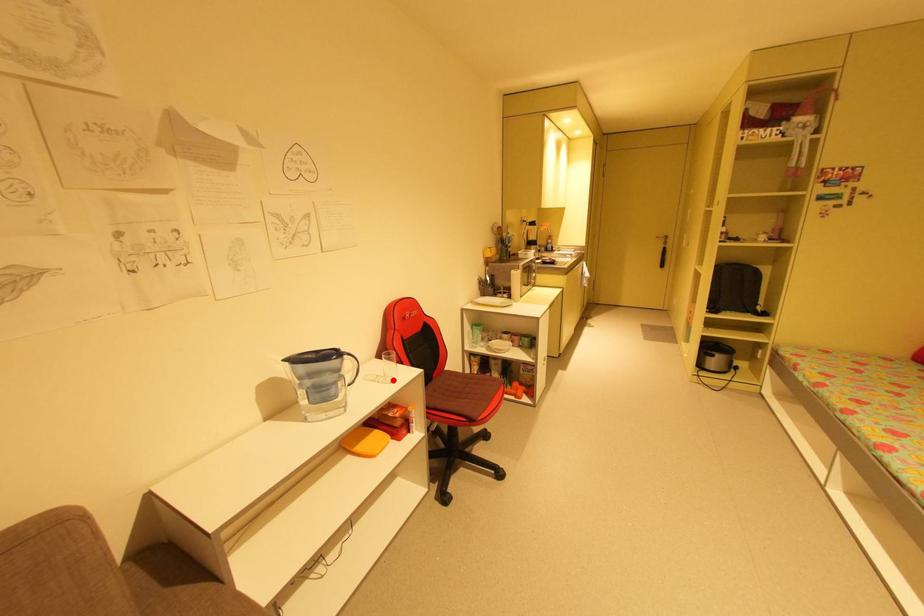
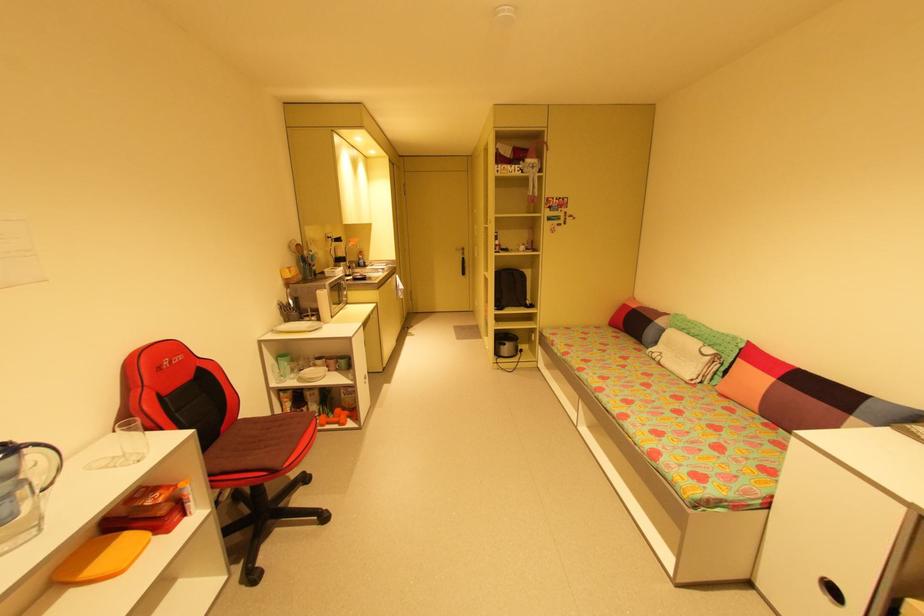
Question: I am providing you with two images of the same scene from different viewpoints. A red point is marked on the first image. Is the red point's position out of view in image 2?

Choices:
 (A) Yes
 (B) No

Answer: (B)